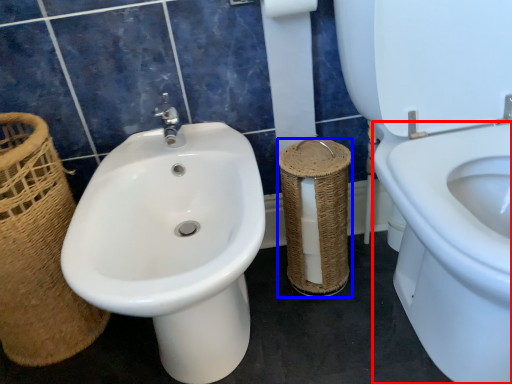
Question: Which of the following is the farthest to the observer, bidet (highlighted by a red box) or basket container (highlighted by a blue box)?

Choices:
 (A) bidet
 (B) basket container

Answer: (B)